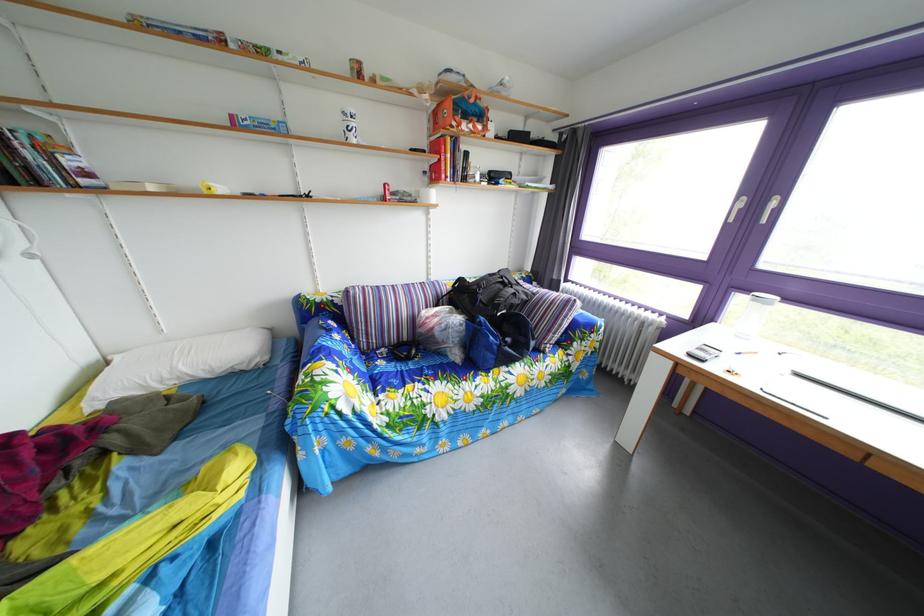
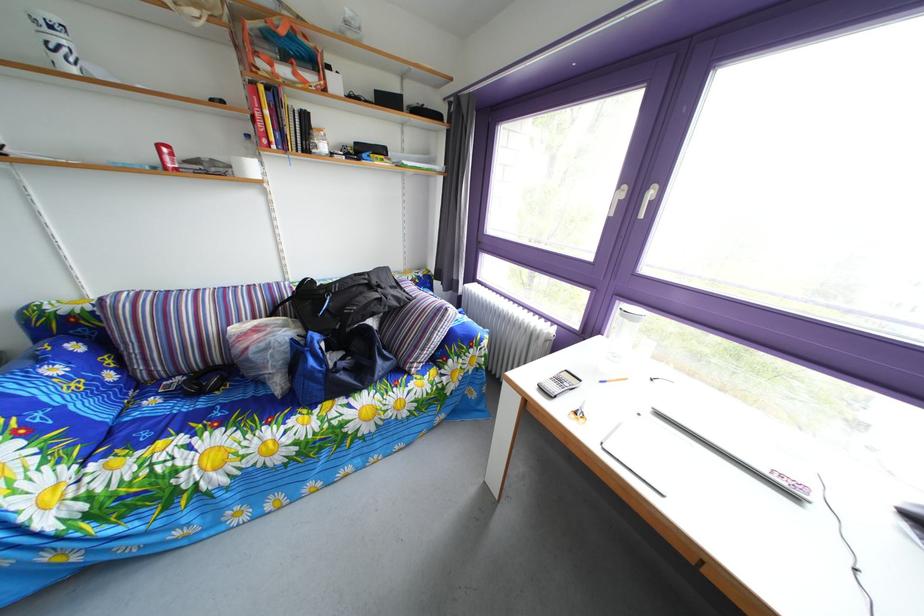
The images are taken continuously from a first-person perspective. In which direction are you moving?

The cameraman walked toward right, forward.